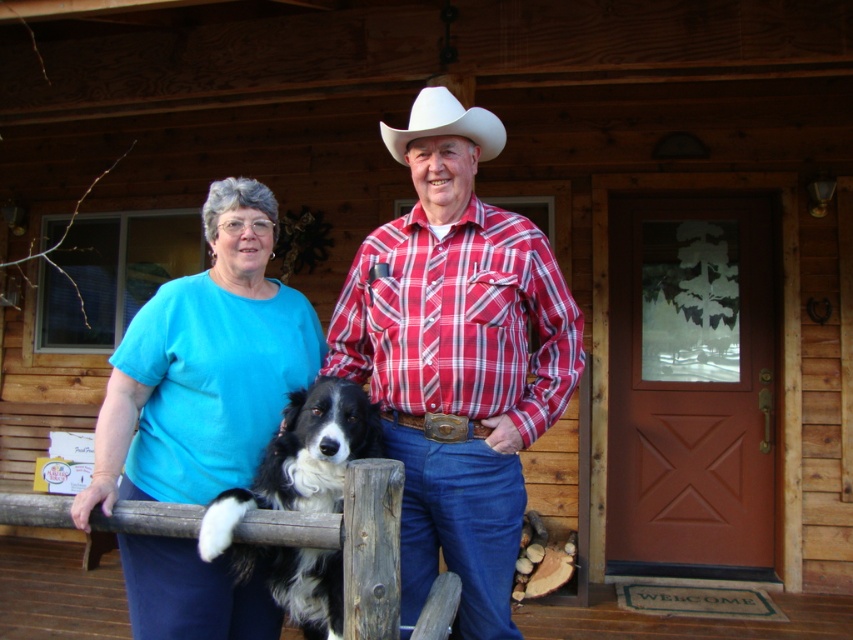
Which is more to the right, black and white fur at center or white felt cowboy hat at center?

white felt cowboy hat at center

Is black and white fur at center thinner than white felt cowboy hat at center?

In fact, black and white fur at center might be wider than white felt cowboy hat at center.

Is point (328, 378) positioned after point (483, 115)?

No, (328, 378) is in front of (483, 115).

In order to click on black and white fur at center in this screenshot , I will do 300,500.

Can you confirm if red plaid shirt at center is bigger than matte blue shirt at center?

Incorrect, red plaid shirt at center is not larger than matte blue shirt at center.

Between point (418, 202) and point (257, 339), which one is positioned behind?

Positioned behind is point (418, 202).

Find the location of a particular element. red plaid shirt at center is located at coordinates [x=457, y=356].

The image size is (853, 640). Identify the location of red plaid shirt at center. (457, 356).

Which of these two, matte blue shirt at center or white felt cowboy hat at center, stands shorter?

white felt cowboy hat at center is shorter.

Does matte blue shirt at center have a lesser height compared to white felt cowboy hat at center?

No, matte blue shirt at center is not shorter than white felt cowboy hat at center.

The height and width of the screenshot is (640, 853). Describe the element at coordinates (204, 368) in the screenshot. I see `matte blue shirt at center` at that location.

The image size is (853, 640). Identify the location of matte blue shirt at center. click(x=204, y=368).